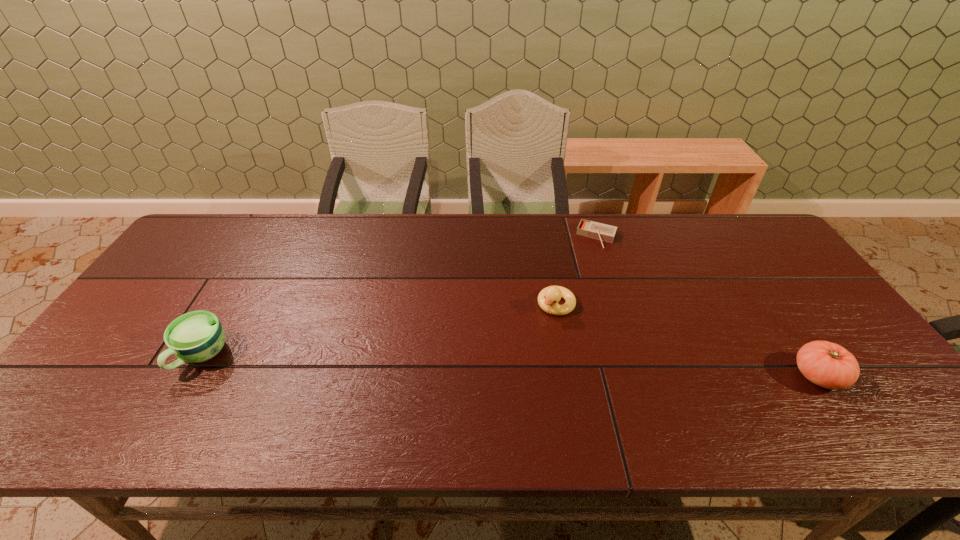
In the image, there is a desktop. What are the coordinates of `free space at the near edge` in the screenshot? It's located at (159, 398).

In the image, there is a desktop. At what (x,y) coordinates should I click in order to perform the action: click on vacant space at the left edge. Please return your answer as a coordinate pair (x, y). This screenshot has width=960, height=540. Looking at the image, I should click on (134, 317).

Find the location of `vacant position at the far right corner of the desktop`. vacant position at the far right corner of the desktop is located at coordinates (713, 221).

Where is `vacant point located between the cup and the third object from right to left`? The height and width of the screenshot is (540, 960). vacant point located between the cup and the third object from right to left is located at coordinates (379, 330).

Locate an element on the screen. Image resolution: width=960 pixels, height=540 pixels. free space between the rightmost object and the duckling is located at coordinates (687, 340).

Locate an element on the screen. The height and width of the screenshot is (540, 960). free space between the third nearest object and the shortest object is located at coordinates (577, 271).

You are a GUI agent. You are given a task and a screenshot of the screen. Output one action in this format:
    pyautogui.click(x=<x>, y=<y>)
    Task: Click on the free spot between the third object from right to left and the rightmost object
    This screenshot has height=540, width=960.
    Given the screenshot: What is the action you would take?
    pyautogui.click(x=687, y=340)

The image size is (960, 540). What are the coordinates of `free space between the tomato and the leftmost object` in the screenshot? It's located at (511, 366).

Where is `vacant space that is in between the cup and the rightmost object`? vacant space that is in between the cup and the rightmost object is located at coordinates (511, 366).

Locate an element on the screen. vacant space that's between the second object from right to left and the tomato is located at coordinates (708, 306).